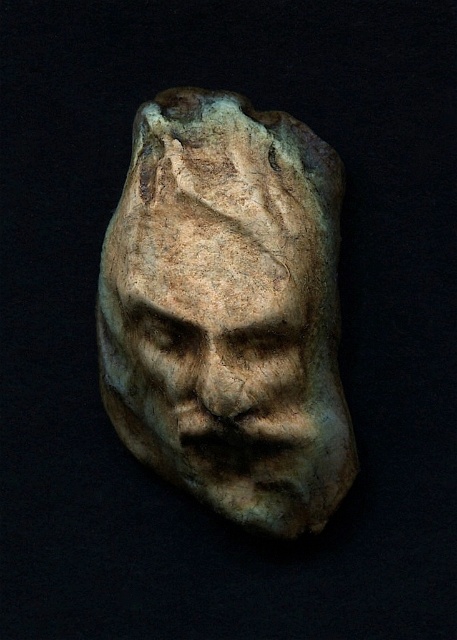
Question: Can you confirm if matte stone face at center is wider than rough stone face at center?

Choices:
 (A) yes
 (B) no

Answer: (A)

Question: Is matte stone face at center to the left of rough stone face at center from the viewer's perspective?

Choices:
 (A) no
 (B) yes

Answer: (B)

Question: Is matte stone face at center wider than rough stone face at center?

Choices:
 (A) no
 (B) yes

Answer: (B)

Question: Among these objects, which one is farthest from the camera?

Choices:
 (A) matte stone face at center
 (B) rough stone face at center

Answer: (A)

Question: Which of the following is the closest to the observer?

Choices:
 (A) rough stone face at center
 (B) matte stone face at center

Answer: (A)